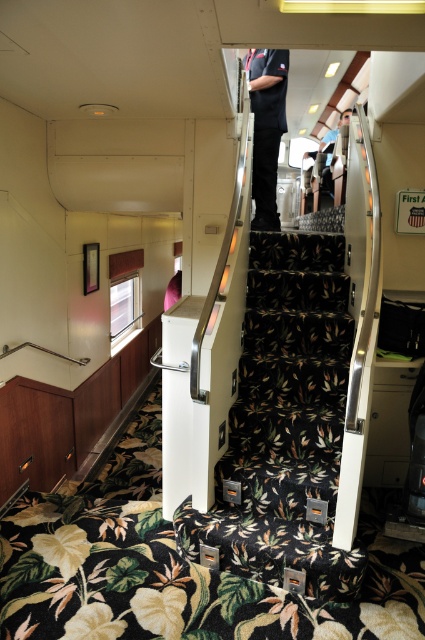
Which is more to the right, floral carpeted stairs at center or dark blue uniform at center?

From the viewer's perspective, dark blue uniform at center appears more on the right side.

Consider the image. Does floral carpeted stairs at center have a smaller size compared to dark blue uniform at center?

No.

Where is `floral carpeted stairs at center`? The height and width of the screenshot is (640, 425). floral carpeted stairs at center is located at coordinates (285, 422).